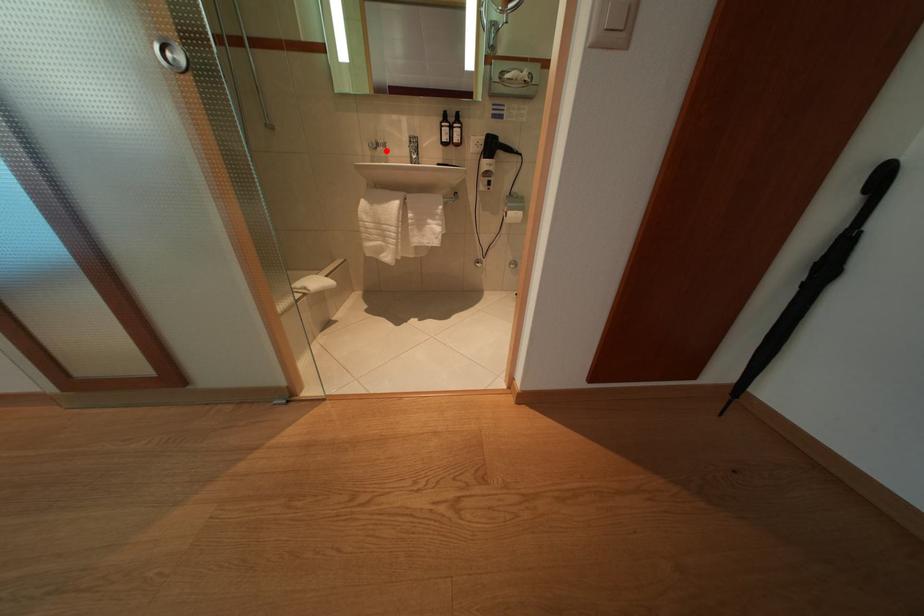
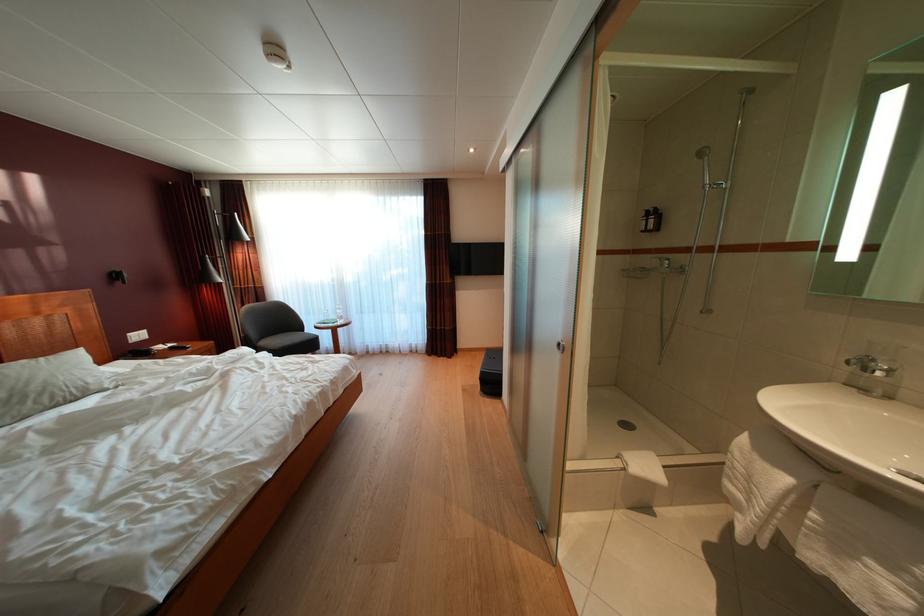
Locate, in the second image, the point that corresponds to the highlighted location in the first image.

(871, 376)